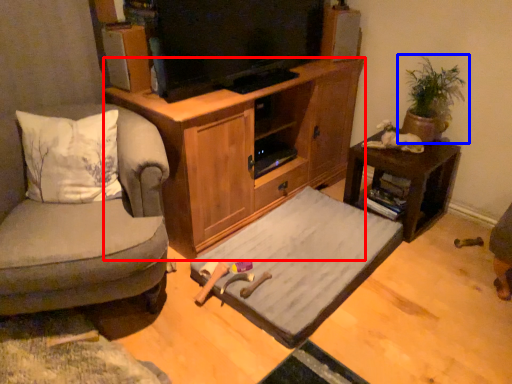
Question: Which point is further to the camera, cabinetry (highlighted by a red box) or houseplant (highlighted by a blue box)?

Choices:
 (A) cabinetry
 (B) houseplant

Answer: (B)